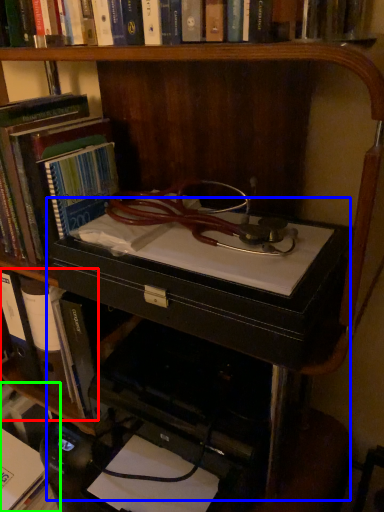
Question: Which is farther away from book (highlighted by a red box)? computer desk (highlighted by a blue box) or book (highlighted by a green box)?

Choices:
 (A) computer desk
 (B) book

Answer: (A)